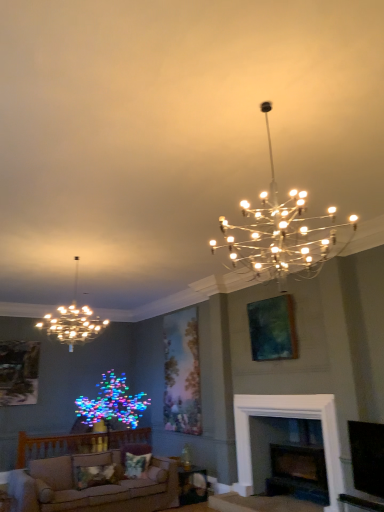
Question: Is dark wood fireplace at lower center taller than metallic chandelier at upper center, which is counted as the 2th lamp, starting from the back?

Choices:
 (A) no
 (B) yes

Answer: (A)

Question: From the image's perspective, is dark wood fireplace at lower center on top of metallic chandelier at upper center, which is counted as the 2th lamp, starting from the back?

Choices:
 (A) yes
 (B) no

Answer: (B)

Question: Is dark wood fireplace at lower center to the right of metallic chandelier at upper center, marked as the second lamp in a left-to-right arrangement, from the viewer's perspective?

Choices:
 (A) no
 (B) yes

Answer: (B)

Question: Is dark wood fireplace at lower center looking in the opposite direction of metallic chandelier at upper center, the first lamp positioned from the front?

Choices:
 (A) yes
 (B) no

Answer: (B)

Question: Can you confirm if dark wood fireplace at lower center is shorter than metallic chandelier at upper center, which is counted as the 2th lamp, starting from the back?

Choices:
 (A) no
 (B) yes

Answer: (B)

Question: Can you confirm if dark wood fireplace at lower center is wider than metallic chandelier at upper center, the first lamp positioned from the front?

Choices:
 (A) no
 (B) yes

Answer: (A)

Question: Is the surface of wooden textured picture frame at left, which is counted as the 1th picture frame, starting from the left, in direct contact with matte gold chandelier at upper left, the 2th lamp in the right-to-left sequence?

Choices:
 (A) no
 (B) yes

Answer: (A)

Question: Is wooden textured picture frame at left, the second picture frame positioned from the right, outside matte gold chandelier at upper left, the 2th lamp in the front-to-back sequence?

Choices:
 (A) yes
 (B) no

Answer: (A)

Question: Does wooden textured picture frame at left, the 1th picture frame from the bottom, have a smaller size compared to matte gold chandelier at upper left, the first lamp viewed from the left?

Choices:
 (A) no
 (B) yes

Answer: (B)

Question: Is wooden textured picture frame at left, arranged as the second picture frame when viewed from the front, facing away from matte gold chandelier at upper left, the first lamp viewed from the left?

Choices:
 (A) yes
 (B) no

Answer: (B)

Question: Is wooden textured picture frame at left, the second picture frame positioned from the right, at the left side of matte gold chandelier at upper left, which appears as the 1th lamp when viewed from the back?

Choices:
 (A) yes
 (B) no

Answer: (A)

Question: Does wooden textured picture frame at left, the 1th picture frame viewed from the back, turn towards matte gold chandelier at upper left, the first lamp viewed from the left?

Choices:
 (A) yes
 (B) no

Answer: (A)

Question: Is teal matte painting at upper right, placed as the 1th picture frame when sorted from front to back, located within dark wood fireplace at lower center?

Choices:
 (A) no
 (B) yes

Answer: (A)